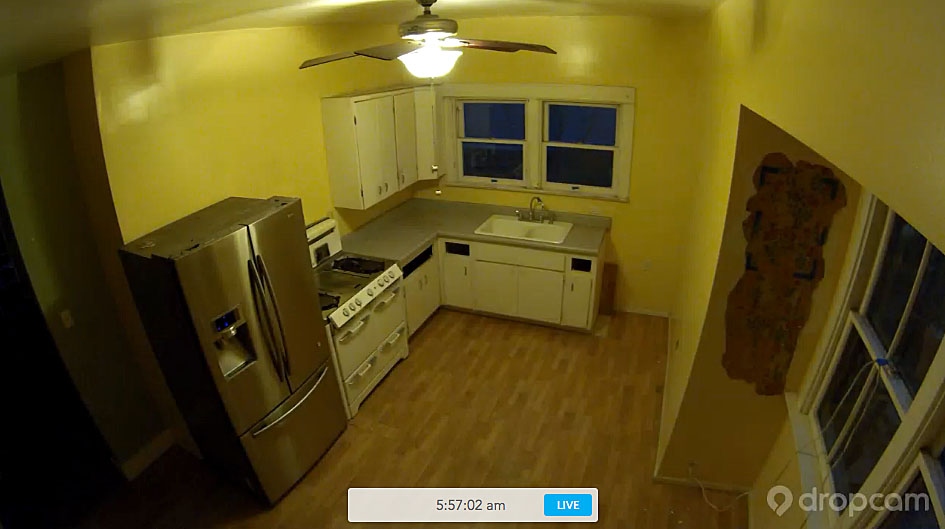
Find the location of a particular element. top cupboards is located at coordinates (367, 135), (413, 143).